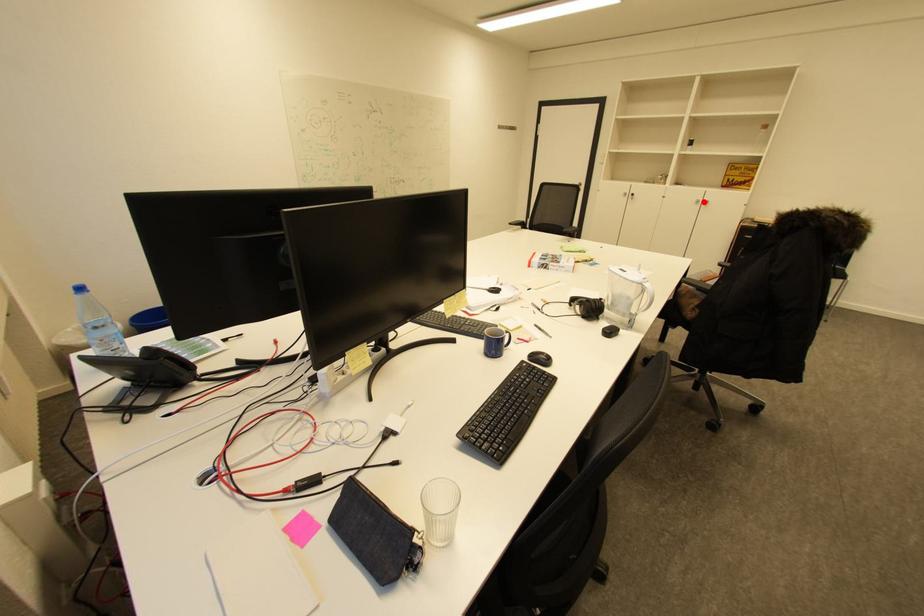
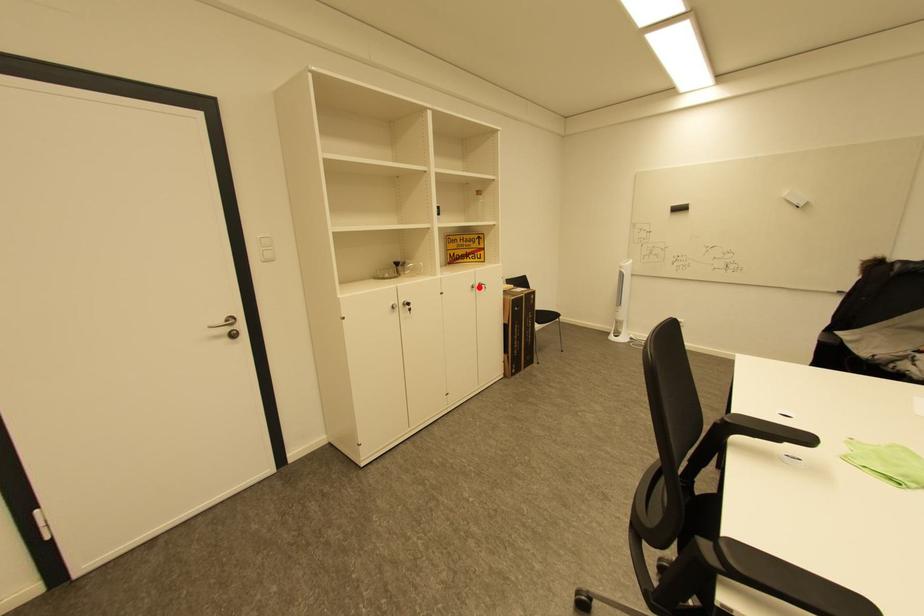
I am providing you with two images of the same scene from different viewpoints. A red point is marked on the first image and another point is marked on the second image. Does the point marked in image1 correspond to the same location as the one in image2?

Yes